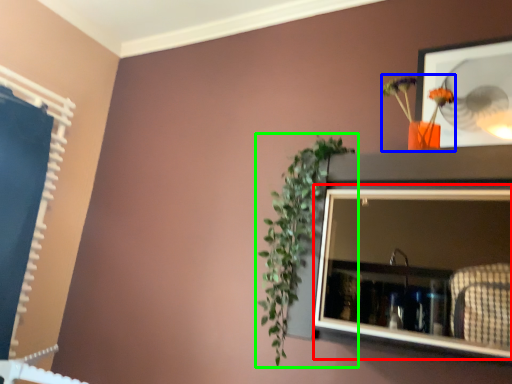
Question: Considering the real-world distances, which object is farthest from medicine cabinet (highlighted by a red box)? floral arrangement (highlighted by a blue box) or houseplant (highlighted by a green box)?

Choices:
 (A) floral arrangement
 (B) houseplant

Answer: (A)